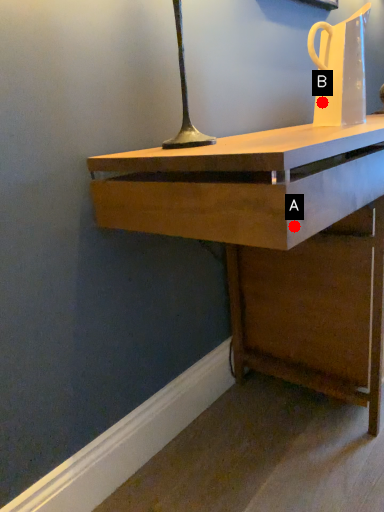
Question: Two points are circled on the image, labeled by A and B beside each circle. Which point is further to the camera?

Choices:
 (A) A is further
 (B) B is further

Answer: (B)